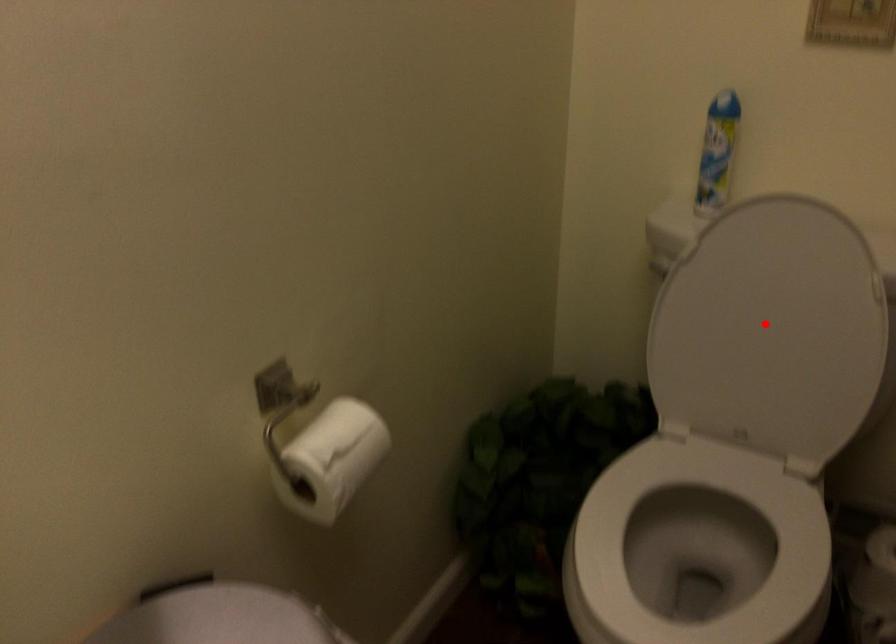
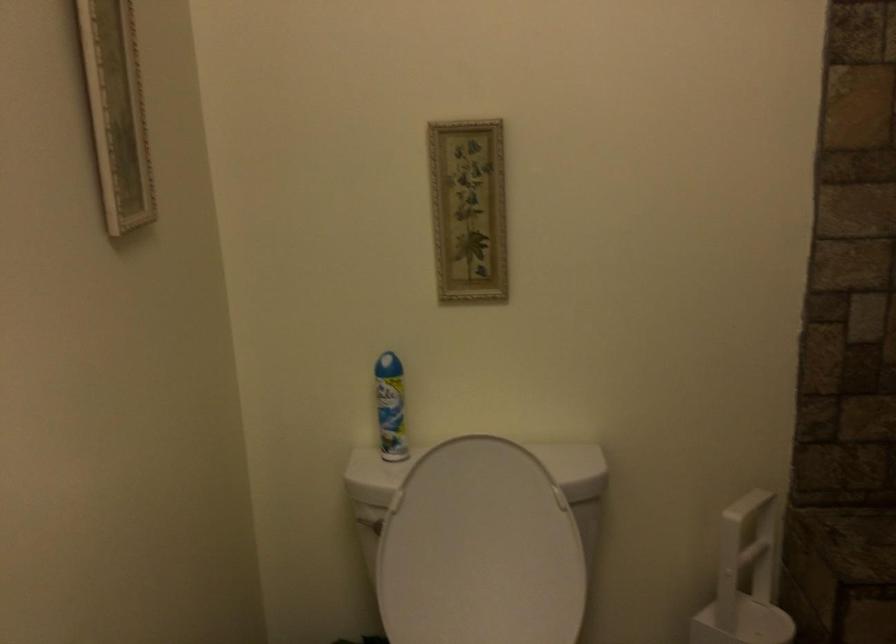
Locate, in the second image, the point that corresponds to the highlighted location in the first image.

(479, 550)